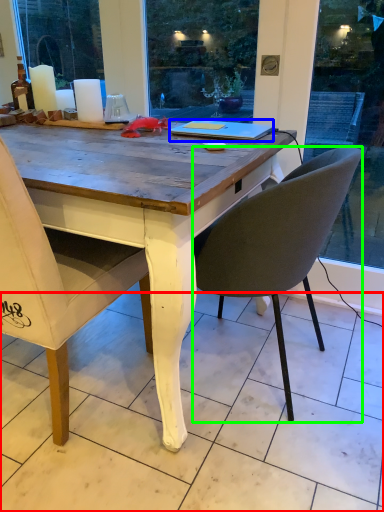
Question: Estimate the real-world distances between objects in this image. Which object is closer to tile (highlighted by a red box), laptop (highlighted by a blue box) or chair (highlighted by a green box)?

Choices:
 (A) laptop
 (B) chair

Answer: (B)